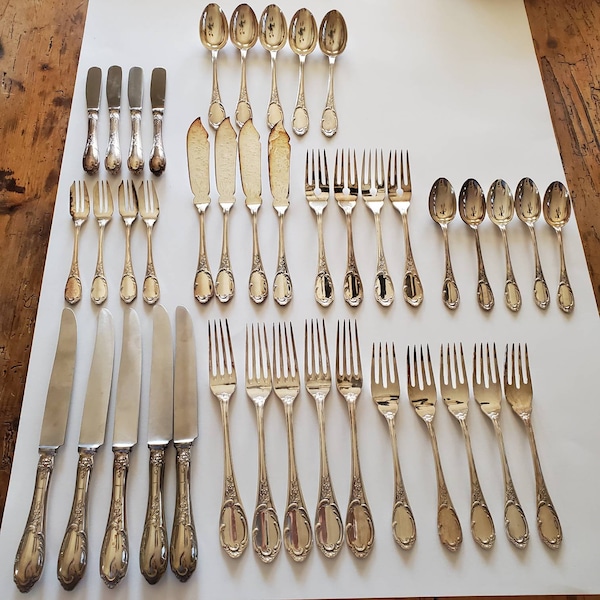
The width and height of the screenshot is (600, 600). Identify the location of dinner fork. [230, 374], [251, 375], [287, 377], [316, 381], [357, 392].